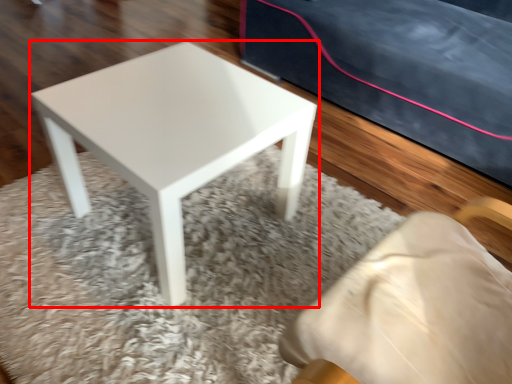
Question: From the image's perspective, where is stool (annotated by the red box) located relative to mat?

Choices:
 (A) below
 (B) above

Answer: (B)